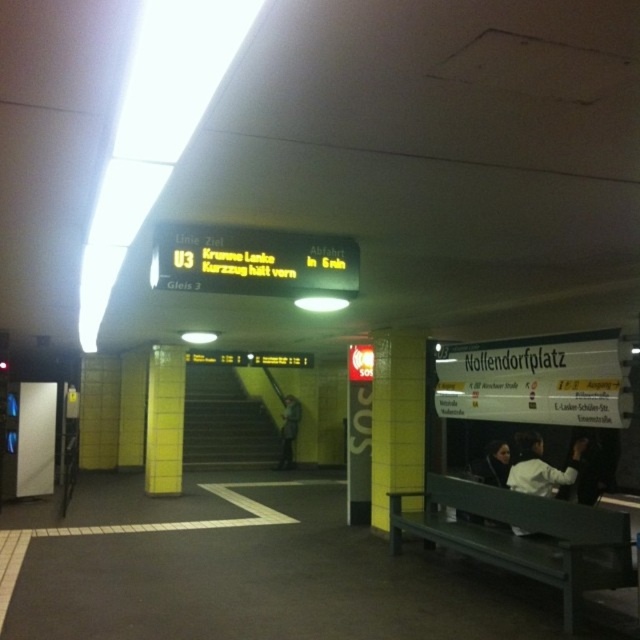
Who is taller, white matte jacket at lower right or dark gray sweater at right?

dark gray sweater at right

Describe the element at coordinates (540, 467) in the screenshot. The height and width of the screenshot is (640, 640). I see `white matte jacket at lower right` at that location.

I want to click on white matte jacket at lower right, so click(x=540, y=467).

Can you confirm if green metal bench at lower right is thinner than dark gray sweater at right?

Incorrect, green metal bench at lower right's width is not less than dark gray sweater at right's.

Measure the distance from green metal bench at lower right to dark gray sweater at right.

green metal bench at lower right is 1.75 meters from dark gray sweater at right.

You are a GUI agent. You are given a task and a screenshot of the screen. Output one action in this format:
    pyautogui.click(x=<x>, y=<y>)
    Task: Click on the green metal bench at lower right
    The height and width of the screenshot is (640, 640).
    Given the screenshot: What is the action you would take?
    pyautogui.click(x=520, y=536)

Between point (592, 456) and point (289, 429), which one is positioned in front?

Point (592, 456)

Does dark gray sweater at right lie behind dark gray jacket at center?

No.

Identify the location of dark gray sweater at right. (586, 470).